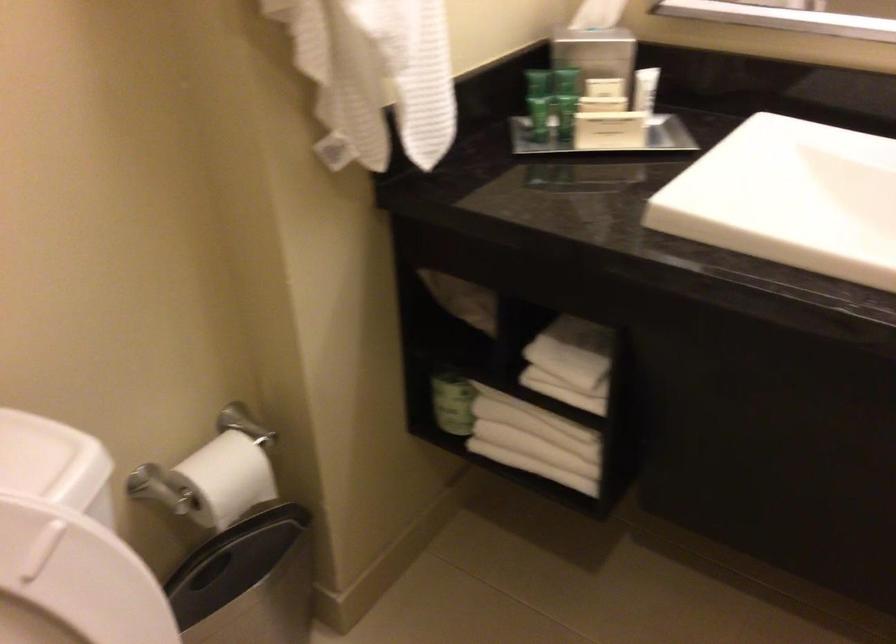
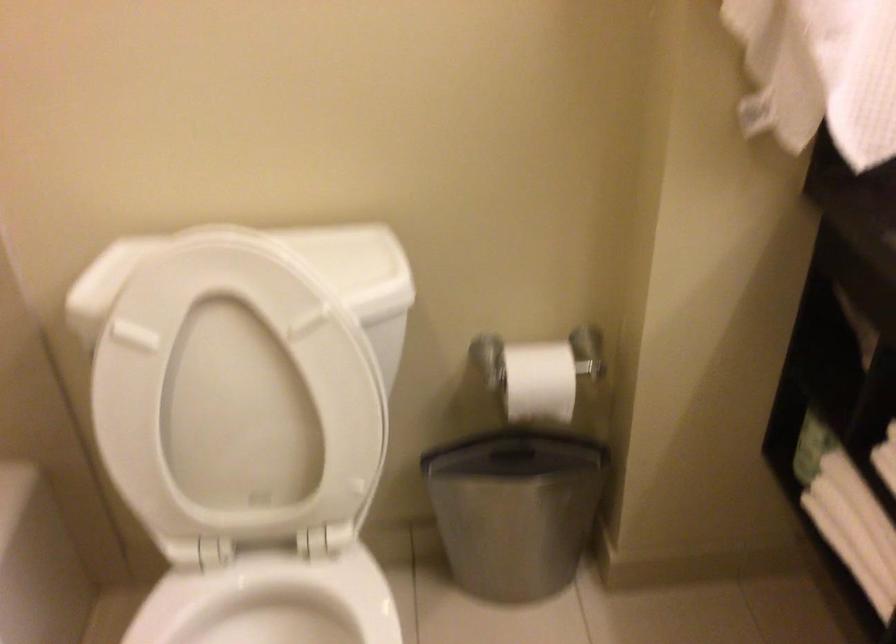
Question: The camera is either moving clockwise (left) or counter-clockwise (right) around the object. The first image is from the beginning of the video and the second image is from the end. Is the camera moving left or right when shooting the video?

Choices:
 (A) Left
 (B) Right

Answer: (B)